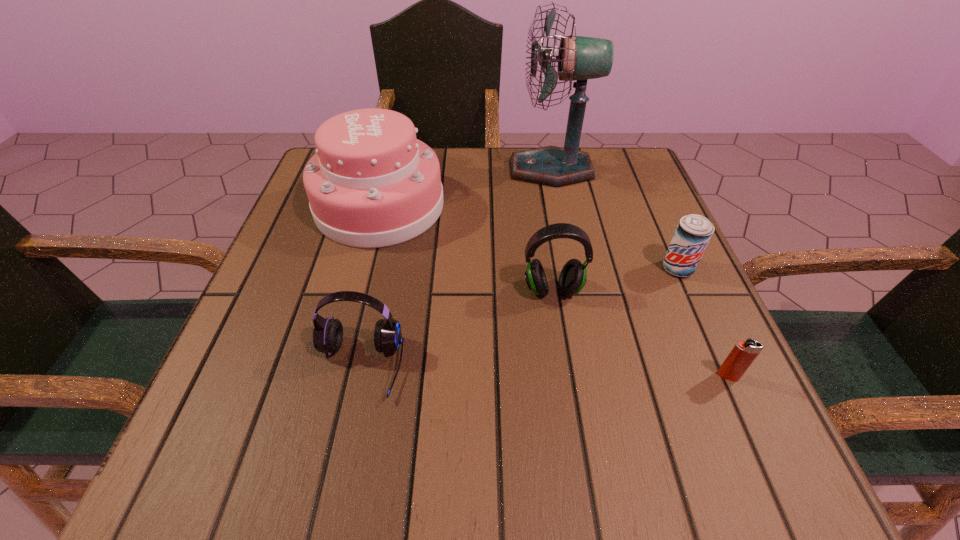
Find the location of a particular element. This screenshot has height=540, width=960. igniter that is at the right edge is located at coordinates (742, 355).

You are a GUI agent. You are given a task and a screenshot of the screen. Output one action in this format:
    pyautogui.click(x=<x>, y=<y>)
    Task: Click on the object located in the far left corner section of the desktop
    Image resolution: width=960 pixels, height=540 pixels.
    Given the screenshot: What is the action you would take?
    pyautogui.click(x=371, y=184)

This screenshot has width=960, height=540. Find the location of `object located in the far right corner section of the desktop`. object located in the far right corner section of the desktop is located at coordinates (580, 58).

Locate an element on the screen. This screenshot has height=540, width=960. free location at the far edge of the desktop is located at coordinates (497, 150).

This screenshot has width=960, height=540. In order to click on vacant space at the near edge of the desktop in this screenshot , I will do `click(436, 447)`.

Identify the location of free space at the left edge of the desktop. (320, 251).

At what (x,y) coordinates should I click in order to perform the action: click on vacant space at the right edge. Please return your answer as a coordinate pair (x, y). Image resolution: width=960 pixels, height=540 pixels. Looking at the image, I should click on (692, 276).

At what (x,y) coordinates should I click in order to perform the action: click on vacant space at the near left corner of the desktop. Please return your answer as a coordinate pair (x, y). Looking at the image, I should click on (167, 490).

At what (x,y) coordinates should I click in order to perform the action: click on vacant region at the far right corner of the desktop. Please return your answer as a coordinate pair (x, y). Image resolution: width=960 pixels, height=540 pixels. Looking at the image, I should click on (604, 150).

Find the location of a particular element. This screenshot has width=960, height=540. vacant region at the near right corner of the desktop is located at coordinates (670, 443).